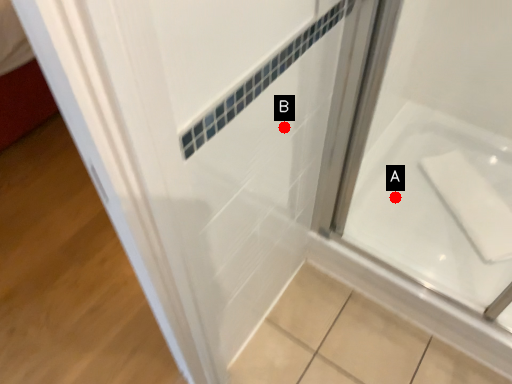
Question: Two points are circled on the image, labeled by A and B beside each circle. Which of the following is the farthest from the observer?

Choices:
 (A) A is further
 (B) B is further

Answer: (A)